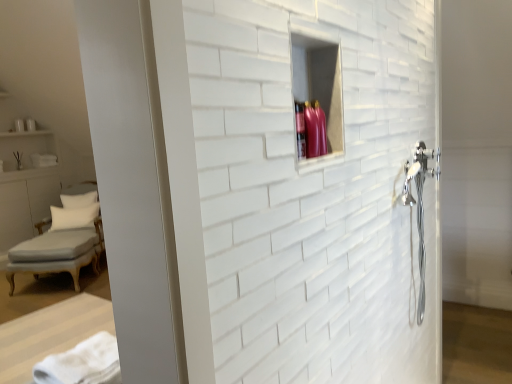
Question: Is light gray fabric chaise at lower left to the left or to the right of white soft pillow at left, which is the 1th pillow in front-to-back order, in the image?

Choices:
 (A) left
 (B) right

Answer: (B)

Question: From the image's perspective, is light gray fabric chaise at lower left above or below white soft pillow at left, which is the 1th pillow in front-to-back order?

Choices:
 (A) below
 (B) above

Answer: (A)

Question: Which object is the farthest from the white soft pillow at left, which is the 1th pillow in front-to-back order?

Choices:
 (A) light gray fabric chaise at lower left
 (B) white soft towel at lower left
 (C) white fabric pillow at left, which is the first pillow in back-to-front order

Answer: (B)

Question: Considering the real-world distances, which object is farthest from the white fabric pillow at left, which is the 2th pillow from front to back?

Choices:
 (A) white soft towel at lower left
 (B) white soft pillow at left, which is the second pillow from back to front
 (C) light gray fabric chaise at lower left

Answer: (A)